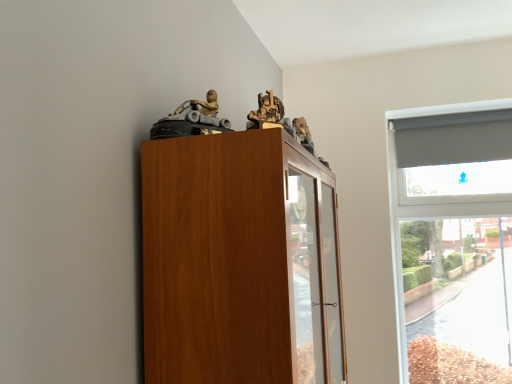
Question: Is wooden figure at upper center, the 2th toy viewed from the left, not within matte gray plastic toy car at upper center, which ranks as the first toy in left-to-right order?

Choices:
 (A) yes
 (B) no

Answer: (A)

Question: Can you confirm if wooden figure at upper center, the first toy in the right-to-left sequence, is taller than matte gray plastic toy car at upper center, which ranks as the first toy in left-to-right order?

Choices:
 (A) no
 (B) yes

Answer: (A)

Question: Is wooden figure at upper center, the first toy in the right-to-left sequence, smaller than matte gray plastic toy car at upper center, which is counted as the second toy, starting from the right?

Choices:
 (A) yes
 (B) no

Answer: (A)

Question: From the image's perspective, is wooden figure at upper center, the first toy in the right-to-left sequence, above matte gray plastic toy car at upper center, which is counted as the second toy, starting from the right?

Choices:
 (A) yes
 (B) no

Answer: (A)

Question: Is wooden figure at upper center, the first toy in the right-to-left sequence, at the right side of matte gray plastic toy car at upper center, which ranks as the first toy in left-to-right order?

Choices:
 (A) yes
 (B) no

Answer: (A)

Question: Relative to matte gray plastic toy car at upper center, which ranks as the first toy in left-to-right order, is wooden cabinet at upper left in front or behind?

Choices:
 (A) front
 (B) behind

Answer: (A)

Question: From the image's perspective, is wooden cabinet at upper left positioned above or below matte gray plastic toy car at upper center, which is counted as the second toy, starting from the right?

Choices:
 (A) below
 (B) above

Answer: (A)

Question: Is wooden cabinet at upper left bigger or smaller than matte gray plastic toy car at upper center, which ranks as the first toy in left-to-right order?

Choices:
 (A) big
 (B) small

Answer: (A)

Question: In terms of height, does wooden cabinet at upper left look taller or shorter compared to matte gray plastic toy car at upper center, which ranks as the first toy in left-to-right order?

Choices:
 (A) tall
 (B) short

Answer: (A)

Question: Based on their sizes in the image, would you say wooden figure at upper center, the first toy in the right-to-left sequence, is bigger or smaller than matte gray plastic toy car at upper center, which ranks as the first toy in left-to-right order?

Choices:
 (A) small
 (B) big

Answer: (A)

Question: Would you say wooden figure at upper center, the first toy in the right-to-left sequence, is inside or outside matte gray plastic toy car at upper center, which is counted as the second toy, starting from the right?

Choices:
 (A) inside
 (B) outside

Answer: (B)

Question: Is wooden figure at upper center, the first toy in the right-to-left sequence, wider or thinner than matte gray plastic toy car at upper center, which is counted as the second toy, starting from the right?

Choices:
 (A) wide
 (B) thin

Answer: (B)

Question: Is point (263, 122) closer or farther from the camera than point (196, 115)?

Choices:
 (A) farther
 (B) closer

Answer: (B)

Question: From the image's perspective, is matte gray plastic toy car at upper center, which ranks as the first toy in left-to-right order, located above or below wooden figure at upper center, the 2th toy viewed from the left?

Choices:
 (A) below
 (B) above

Answer: (A)

Question: In terms of size, does matte gray plastic toy car at upper center, which ranks as the first toy in left-to-right order, appear bigger or smaller than wooden figure at upper center, the 2th toy viewed from the left?

Choices:
 (A) small
 (B) big

Answer: (B)